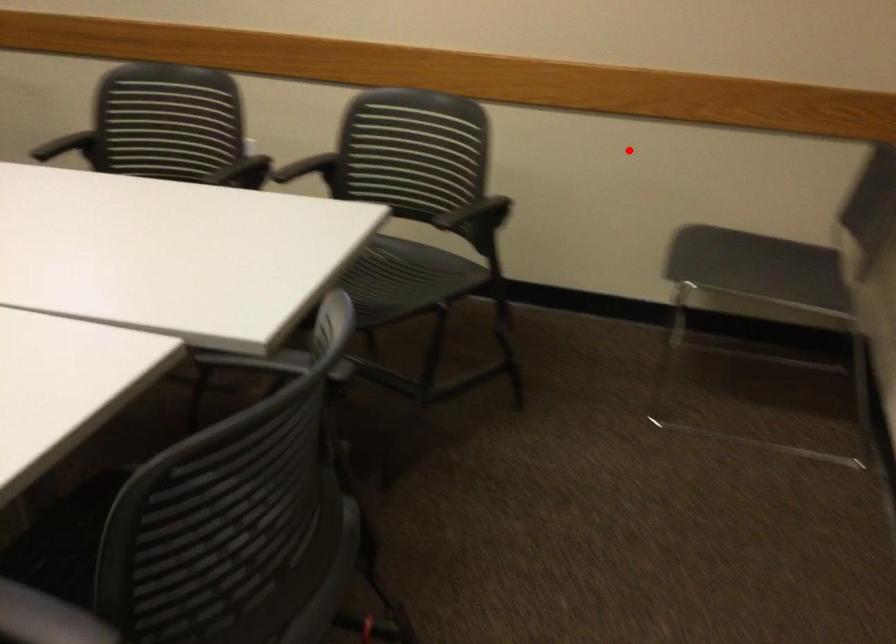
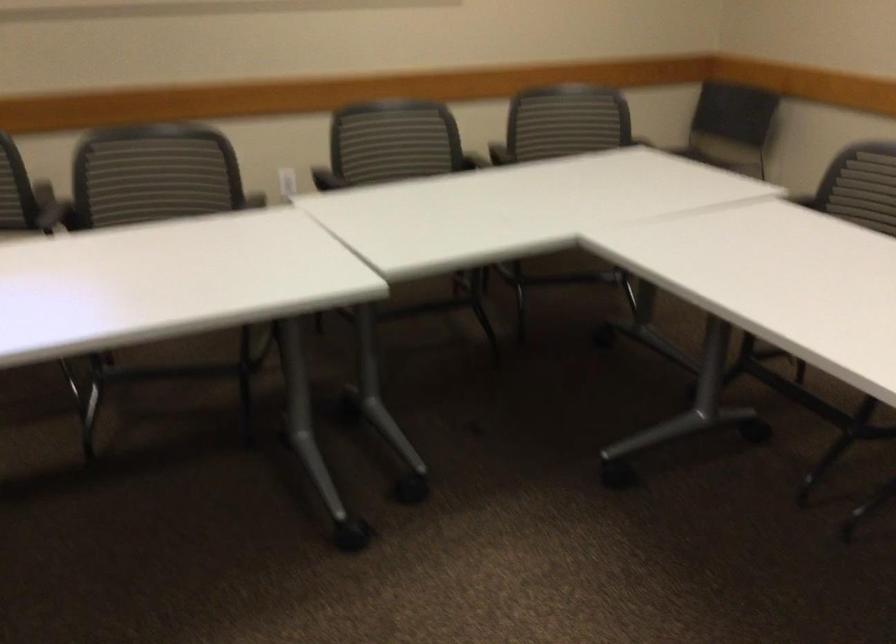
Question: I am providing you with two images of the same scene from different viewpoints. In image1, a red point is highlighted. Considering the same 3D point in image2, which of the following is correct?

Choices:
 (A) It is closer
 (B) It is farther

Answer: (B)